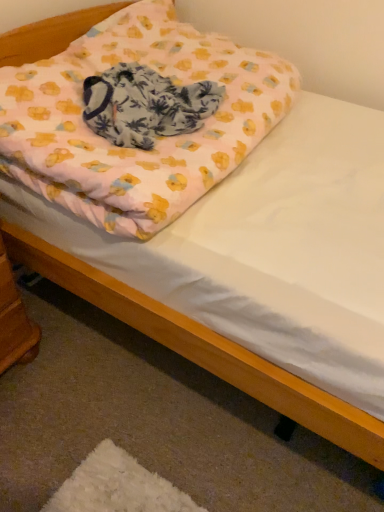
What do you see at coordinates (145, 105) in the screenshot? I see `pink fabric blanket at center` at bounding box center [145, 105].

Describe the element at coordinates (157, 139) in the screenshot. The image size is (384, 512). I see `pink fabric pillow at upper center` at that location.

You are a GUI agent. You are given a task and a screenshot of the screen. Output one action in this format:
    pyautogui.click(x=<x>, y=<y>)
    Task: Click on the wooden changing table at lower left
    This screenshot has height=512, width=384.
    Given the screenshot: What is the action you would take?
    pyautogui.click(x=14, y=320)

From a real-world perspective, is wooden changing table at lower left positioned above or below pink fabric pillow at upper center?

From a real-world perspective, wooden changing table at lower left is physically below pink fabric pillow at upper center.

From the image's perspective, is wooden changing table at lower left positioned above or below pink fabric pillow at upper center?

From the image's perspective, wooden changing table at lower left appears below pink fabric pillow at upper center.

The height and width of the screenshot is (512, 384). Find the location of `changing table beneath the pink fabric pillow at upper center (from a real-world perspective)`. changing table beneath the pink fabric pillow at upper center (from a real-world perspective) is located at coordinates (14, 320).

Would you say wooden changing table at lower left is outside pink fabric pillow at upper center?

wooden changing table at lower left is positioned outside pink fabric pillow at upper center.

Can you confirm if pink fabric pillow at upper center is taller than pink fabric blanket at center?

Correct, pink fabric pillow at upper center is much taller as pink fabric blanket at center.

Which object is positioned more to the left, pink fabric pillow at upper center or pink fabric blanket at center?

From the viewer's perspective, pink fabric blanket at center appears more on the left side.

Is pink fabric pillow at upper center aimed at pink fabric blanket at center?

Yes, pink fabric pillow at upper center faces towards pink fabric blanket at center.

Is pink fabric blanket at center a part of pink fabric pillow at upper center?

Yes.

Does pink fabric blanket at center appear on the right side of wooden changing table at lower left?

Indeed, pink fabric blanket at center is positioned on the right side of wooden changing table at lower left.

Based on the photo, from the image's perspective, is pink fabric blanket at center under wooden changing table at lower left?

No.

From a real-world perspective, is pink fabric blanket at center positioned above or below wooden changing table at lower left?

From a real-world perspective, pink fabric blanket at center is physically above wooden changing table at lower left.

Can you confirm if pink fabric pillow at upper center is positioned to the right of wooden changing table at lower left?

Yes, pink fabric pillow at upper center is to the right of wooden changing table at lower left.

Is pink fabric pillow at upper center wider than wooden changing table at lower left?

Indeed, pink fabric pillow at upper center has a greater width compared to wooden changing table at lower left.

Is pink fabric pillow at upper center aimed at wooden changing table at lower left?

No, pink fabric pillow at upper center is not facing towards wooden changing table at lower left.

Considering the sizes of objects pink fabric blanket at center and pink fabric pillow at upper center in the image provided, who is shorter, pink fabric blanket at center or pink fabric pillow at upper center?

With less height is pink fabric blanket at center.

Is pink fabric blanket at center inside the boundaries of pink fabric pillow at upper center, or outside?

pink fabric blanket at center lies within the bounds of pink fabric pillow at upper center.

Find the location of a particular element. The height and width of the screenshot is (512, 384). pillow above the pink fabric blanket at center (from the image's perspective) is located at coordinates (157, 139).

Is wooden changing table at lower left inside or outside of pink fabric blanket at center?

wooden changing table at lower left lies outside pink fabric blanket at center.

Considering the sizes of wooden changing table at lower left and pink fabric blanket at center in the image, is wooden changing table at lower left wider or thinner than pink fabric blanket at center?

Clearly, wooden changing table at lower left has less width compared to pink fabric blanket at center.

Considering the sizes of objects wooden changing table at lower left and pink fabric blanket at center in the image provided, who is bigger, wooden changing table at lower left or pink fabric blanket at center?

wooden changing table at lower left is bigger.

Where is `pillow in front of the wooden changing table at lower left`? This screenshot has width=384, height=512. pillow in front of the wooden changing table at lower left is located at coordinates (157, 139).

Locate an element on the screen. Image resolution: width=384 pixels, height=512 pixels. pillow above the pink fabric blanket at center (from the image's perspective) is located at coordinates (157, 139).

When comparing their distances from wooden changing table at lower left, does pink fabric pillow at upper center or pink fabric blanket at center seem closer?

Based on the image, pink fabric blanket at center appears to be nearer to wooden changing table at lower left.

Looking at this image, when comparing their distances from pink fabric pillow at upper center, does pink fabric blanket at center or wooden changing table at lower left seem further?

The object further to pink fabric pillow at upper center is wooden changing table at lower left.

When comparing their distances from pink fabric blanket at center, does wooden changing table at lower left or pink fabric pillow at upper center seem further?

wooden changing table at lower left is further to pink fabric blanket at center.

Based on their spatial positions, is pink fabric blanket at center or pink fabric pillow at upper center further from wooden changing table at lower left?

pink fabric pillow at upper center is positioned further to the anchor wooden changing table at lower left.

Considering their positions, is pink fabric pillow at upper center positioned further to pink fabric blanket at center than wooden changing table at lower left?

wooden changing table at lower left.

From the image, which object appears to be farther from pink fabric pillow at upper center, wooden changing table at lower left or pink fabric blanket at center?

Among the two, wooden changing table at lower left is located further to pink fabric pillow at upper center.

The width and height of the screenshot is (384, 512). Find the location of `blanket that lies between pink fabric pillow at upper center and wooden changing table at lower left from top to bottom`. blanket that lies between pink fabric pillow at upper center and wooden changing table at lower left from top to bottom is located at coordinates (145, 105).